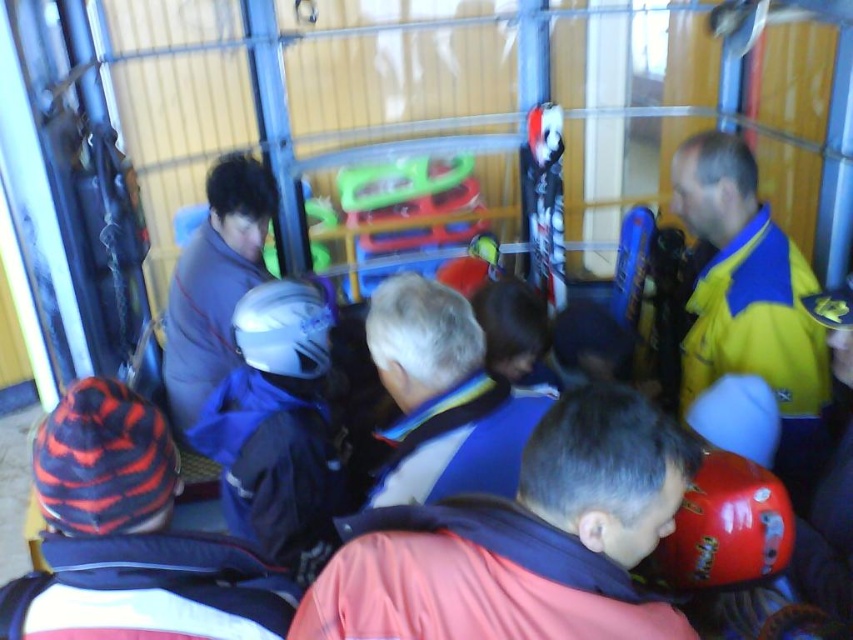
You are standing in the storage area and need to locate the striped knit hat at lower left. According to the coordinates provided, where exactly is it positioned?

The striped knit hat at lower left is located at the 2D coordinates point (102,460).

You are organizing a gear check for winter sports participants. You have a storage box that can only fit items narrower than the gray fabric jacket at center. Can the white matte helmet at center fit into the box?

The gray fabric jacket at center is wider than the white matte helmet at center. Since the storage box can only fit items narrower than the gray fabric jacket at center, the white matte helmet at center can fit into the box because it is narrower.